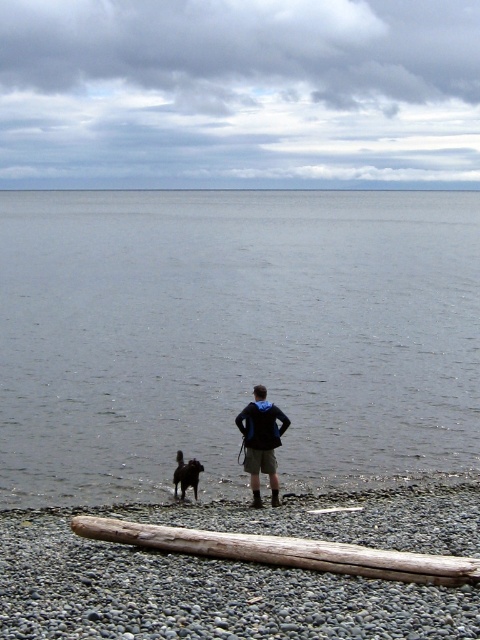
You are a hiker who wants to cross the smooth gray water at lower center and the smooth pebbles at lower center to reach the other side. Which one would be easier to walk on?

The smooth gray water at lower center is larger in size than the smooth pebbles at lower center, so it might be easier to walk on the smooth gray water at lower center since it provides a more stable surface area.